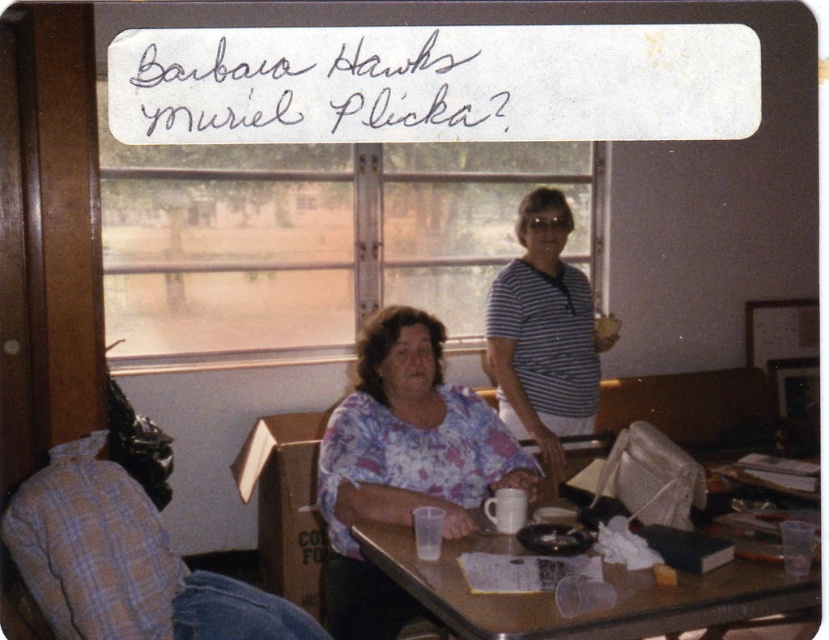
Is point (503, 353) positioned after point (604, 314)?

That is False.

Which of these two, striped cotton shirt at center or matte plastic bag at upper center, stands shorter?

Standing shorter between the two is matte plastic bag at upper center.

Between point (545, 451) and point (604, 330), which one is positioned behind?

The point (604, 330) is more distant.

The height and width of the screenshot is (640, 829). Find the location of `striped cotton shirt at center`. striped cotton shirt at center is located at coordinates (543, 332).

Is wooden table at center in front of striped cotton shirt at center?

Yes, wooden table at center is closer to the viewer.

Measure the distance from wooden table at center to striped cotton shirt at center.

They are 3.52 feet apart.

Is point (474, 620) positioned after point (531, 228)?

That is False.

At what (x,y) coordinates should I click in order to perform the action: click on wooden table at center. Please return your answer as a coordinate pair (x, y). The height and width of the screenshot is (640, 829). Looking at the image, I should click on coord(588,612).

Is floral fabric blouse at center above wooden table at center?

Indeed, floral fabric blouse at center is positioned over wooden table at center.

Can you confirm if floral fabric blouse at center is bigger than wooden table at center?

Indeed, floral fabric blouse at center has a larger size compared to wooden table at center.

In order to click on floral fabric blouse at center in this screenshot , I will do point(403,464).